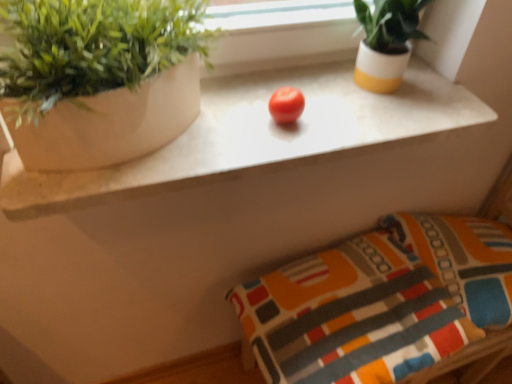
The height and width of the screenshot is (384, 512). Find the location of `vacant space to the right of white glossy pot at upper right`. vacant space to the right of white glossy pot at upper right is located at coordinates (437, 90).